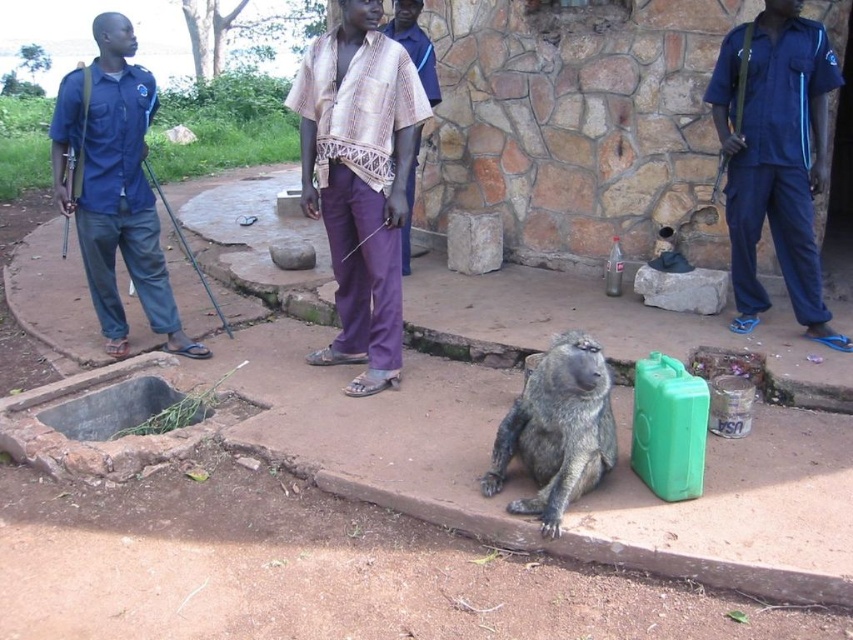
Question: Which of these objects is positioned farthest from the blue uniform at left?

Choices:
 (A) patterned fabric shirt at center
 (B) purple cotton pants at center

Answer: (A)

Question: Does purple cotton pants at center have a smaller size compared to patterned fabric shirt at center?

Choices:
 (A) yes
 (B) no

Answer: (B)

Question: In this image, where is blue uniform at right located relative to gray furry monkey at center?

Choices:
 (A) below
 (B) above

Answer: (B)

Question: Which object is the closest to the blue uniform at left?

Choices:
 (A) blue uniform at right
 (B) patterned fabric shirt at center
 (C) gray furry monkey at center

Answer: (B)

Question: Does purple cotton pants at center have a lesser width compared to blue uniform at left?

Choices:
 (A) yes
 (B) no

Answer: (A)

Question: Which point is closer to the camera?

Choices:
 (A) purple cotton pants at center
 (B) gray furry monkey at center
 (C) patterned fabric shirt at center

Answer: (B)